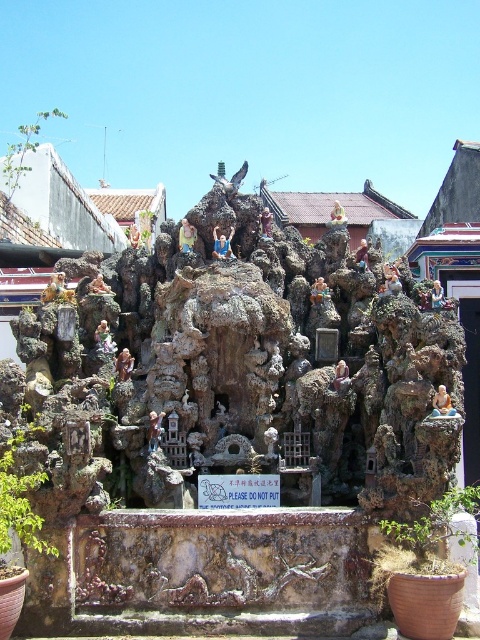
Question: Is rusty stone sculpture at center bigger than matte gold statue at center?

Choices:
 (A) no
 (B) yes

Answer: (B)

Question: Among these objects, which one is farthest from the camera?

Choices:
 (A) rusty stone sculpture at center
 (B) matte gold statue at center

Answer: (B)

Question: Which point is closer to the camera?

Choices:
 (A) (52, 452)
 (B) (187, 225)

Answer: (A)

Question: Can you confirm if rusty stone sculpture at center is wider than matte gold statue at center?

Choices:
 (A) no
 (B) yes

Answer: (B)

Question: Is rusty stone sculpture at center below matte gold statue at center?

Choices:
 (A) no
 (B) yes

Answer: (B)